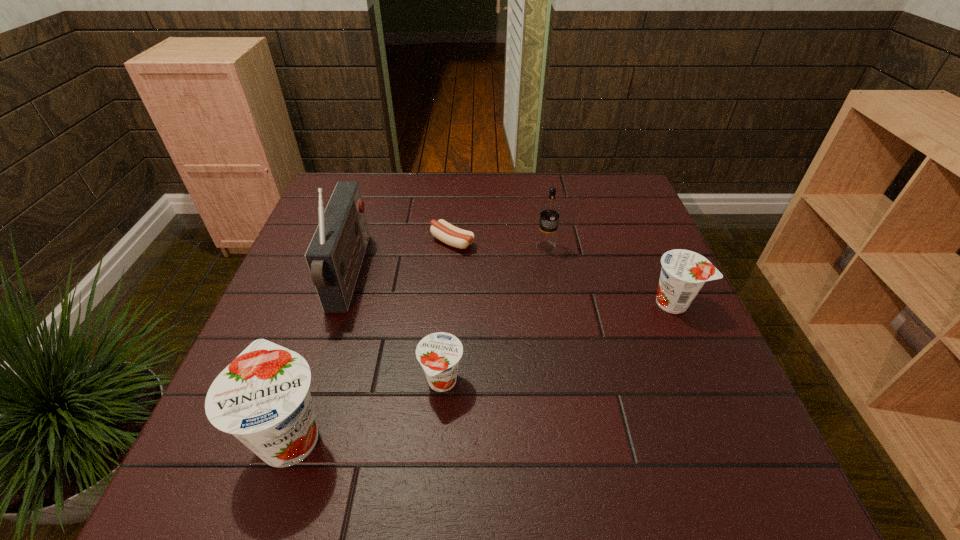
This screenshot has width=960, height=540. In the image, there is a desktop. What are the coordinates of `free space at the left edge` in the screenshot? It's located at (288, 267).

The width and height of the screenshot is (960, 540). In order to click on vacant space at the right edge of the desktop in this screenshot , I will do `click(691, 343)`.

The image size is (960, 540). Identify the location of vacant space at the far left corner. (342, 176).

Locate an element on the screen. Image resolution: width=960 pixels, height=540 pixels. free space at the far right corner of the desktop is located at coordinates (605, 201).

This screenshot has height=540, width=960. I want to click on free space between the shortest yogurt and the second shortest yogurt, so click(558, 342).

What are the coordinates of `empty space between the tallest object and the rightmost yogurt` in the screenshot? It's located at (512, 289).

Locate an element on the screen. The image size is (960, 540). unoccupied position between the shortest yogurt and the radio receiver is located at coordinates (396, 329).

Find the location of a particular element. This screenshot has height=540, width=960. free spot between the shortest object and the vodka is located at coordinates (499, 245).

Identify the location of empty space that is in between the tallest yogurt and the tallest object. Image resolution: width=960 pixels, height=540 pixels. (321, 355).

Identify the location of vacant space that's between the fifth object from left to right and the second yogurt from right to left. This screenshot has height=540, width=960. (493, 315).